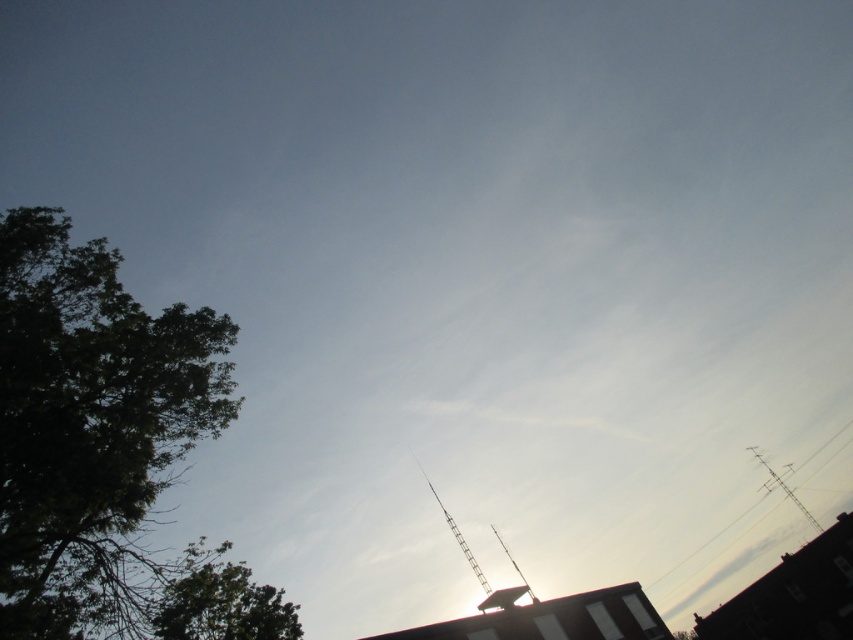
You are an artist painting this scene. You need to decide which object, the green leafy tree at lower left or the metallic wire at upper right, you should paint first if you want to ensure proper layering based on their widths. Which one should you start with?

The green leafy tree at lower left has a lesser width compared to the metallic wire at upper right. Since it is narrower, you should paint the green leafy tree at lower left first to ensure proper layering, as smaller elements are often painted first to allow for adjustments over broader areas.

You are an observer looking at the sky scene. You notice the green leafy tree at lower left and the metallic wire at upper right. Which object appears taller in the image?

The metallic wire at upper right appears taller than the green leafy tree at lower left according to the description.

You are an artist sketching the scene. You notice the green leafy tree at left and the metallic wire at upper right. Which object should you draw first if you want to follow the rule of drawing smaller objects before larger ones?

The green leafy tree at left should be drawn first because it is smaller than the metallic wire at upper right.